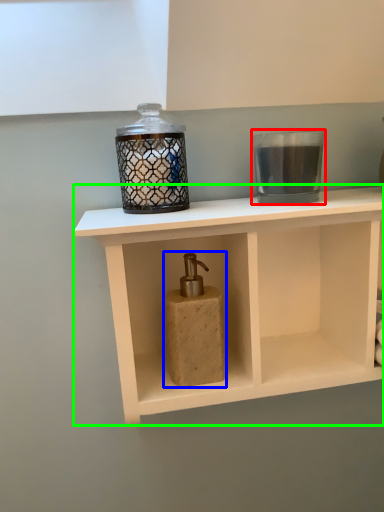
Question: Which object is positioned closest to candle holder (highlighted by a red box)? Select from soap dispenser (highlighted by a blue box) and shelf (highlighted by a green box).

Choices:
 (A) soap dispenser
 (B) shelf

Answer: (B)